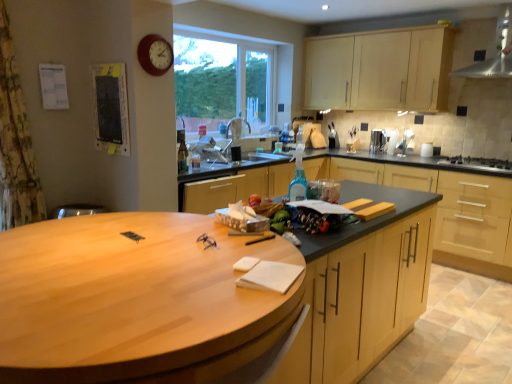
Question: Can you confirm if satin silver kettle at upper right is bigger than wooden clock at upper left?

Choices:
 (A) no
 (B) yes

Answer: (B)

Question: From a real-world perspective, is satin silver kettle at upper right on top of wooden clock at upper left?

Choices:
 (A) no
 (B) yes

Answer: (A)

Question: Is satin silver kettle at upper right to the right of wooden clock at upper left from the viewer's perspective?

Choices:
 (A) yes
 (B) no

Answer: (A)

Question: From the image's perspective, does satin silver kettle at upper right appear higher than wooden clock at upper left?

Choices:
 (A) no
 (B) yes

Answer: (A)

Question: Does satin silver kettle at upper right have a greater width compared to wooden clock at upper left?

Choices:
 (A) yes
 (B) no

Answer: (A)

Question: Is satin silver kettle at upper right located outside wooden clock at upper left?

Choices:
 (A) no
 (B) yes

Answer: (B)

Question: Is matte black bulletin board at upper left a part of stainless steel exhaust hood at upper right?

Choices:
 (A) no
 (B) yes

Answer: (A)

Question: Is stainless steel exhaust hood at upper right outside matte black bulletin board at upper left?

Choices:
 (A) yes
 (B) no

Answer: (A)

Question: From a real-world perspective, is stainless steel exhaust hood at upper right physically below matte black bulletin board at upper left?

Choices:
 (A) yes
 (B) no

Answer: (B)

Question: Considering the relative sizes of stainless steel exhaust hood at upper right and matte black bulletin board at upper left in the image provided, is stainless steel exhaust hood at upper right smaller than matte black bulletin board at upper left?

Choices:
 (A) yes
 (B) no

Answer: (B)

Question: Does stainless steel exhaust hood at upper right have a greater height compared to matte black bulletin board at upper left?

Choices:
 (A) no
 (B) yes

Answer: (B)

Question: Is stainless steel exhaust hood at upper right facing away from matte black bulletin board at upper left?

Choices:
 (A) no
 (B) yes

Answer: (A)

Question: From the image's perspective, is matte wood cabinets at center, the 2th cabinetry in the top-to-bottom sequence, below matte black bulletin board at upper left?

Choices:
 (A) no
 (B) yes

Answer: (B)